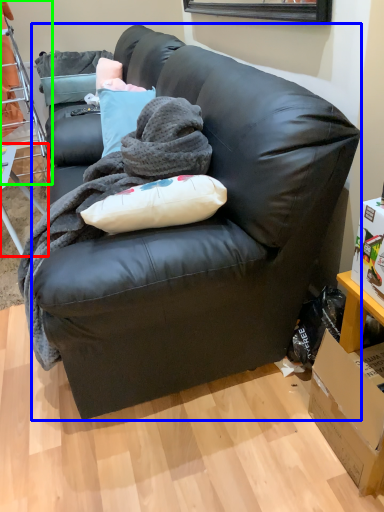
Question: Considering the real-world distances, which object is farthest from table (highlighted by a red box)? studio couch (highlighted by a blue box) or bunk bed (highlighted by a green box)?

Choices:
 (A) studio couch
 (B) bunk bed

Answer: (A)